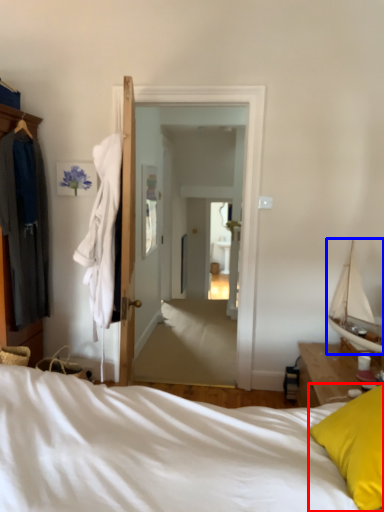
Question: Which point is further to the camera, pillow (highlighted by a red box) or boat (highlighted by a blue box)?

Choices:
 (A) pillow
 (B) boat

Answer: (B)